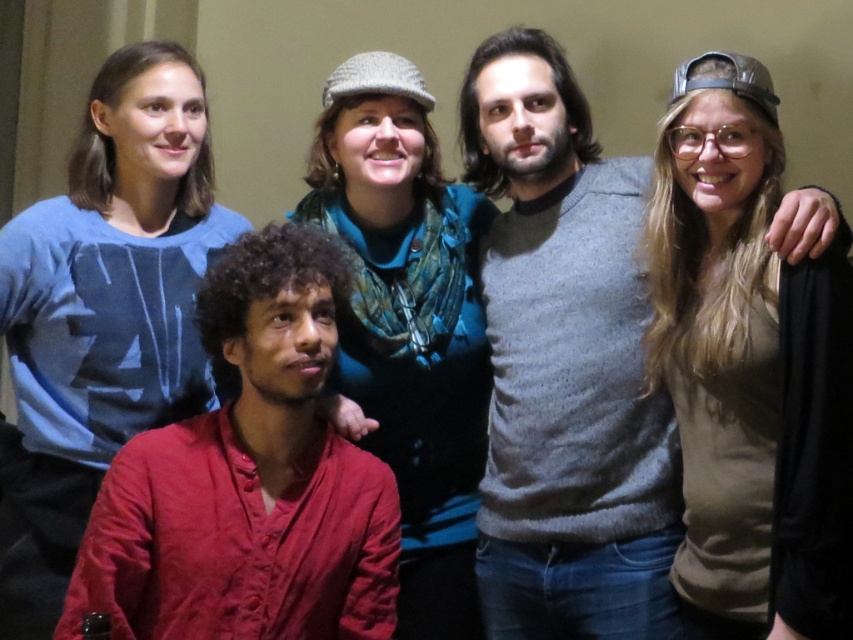
Question: Which of the following is the farthest from the observer?

Choices:
 (A) gray sweater at center
 (B) red linen shirt at lower left

Answer: (A)

Question: Observing the image, what is the correct spatial positioning of red linen shirt at lower left in reference to blue cotton shirt at upper left?

Choices:
 (A) above
 (B) below

Answer: (B)

Question: Does red linen shirt at lower left appear on the left side of blue cotton shirt at upper left?

Choices:
 (A) no
 (B) yes

Answer: (A)

Question: Estimate the real-world distances between objects in this image. Which object is closer to the red linen shirt at lower left?

Choices:
 (A) knitted wool hat at upper center
 (B) blue cotton shirt at upper left

Answer: (A)

Question: Which object is closer to the camera taking this photo?

Choices:
 (A) red linen shirt at lower left
 (B) knitted wool hat at upper center
 (C) blue cotton shirt at upper left
 (D) gray sweater at center

Answer: (A)

Question: Is red linen shirt at lower left above blue cotton shirt at upper left?

Choices:
 (A) no
 (B) yes

Answer: (A)